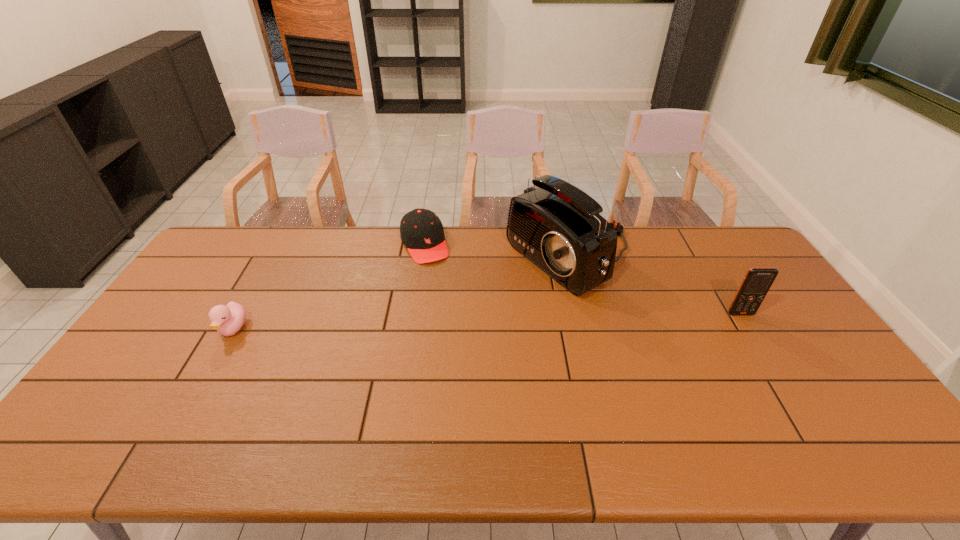
Image resolution: width=960 pixels, height=540 pixels. Identify the location of the leftmost object. pos(228,320).

Image resolution: width=960 pixels, height=540 pixels. What are the coordinates of `the rightmost object` in the screenshot? It's located at (757, 281).

Find the location of `cellular telephone`. cellular telephone is located at coordinates click(757, 281).

The height and width of the screenshot is (540, 960). Find the location of `cap`. cap is located at coordinates (421, 231).

The width and height of the screenshot is (960, 540). Identify the location of radio receiver. (557, 226).

This screenshot has width=960, height=540. I want to click on the third object from left to right, so click(x=557, y=226).

Find the location of a particular element. The height and width of the screenshot is (540, 960). vacant region located on the front-facing side of the leftmost object is located at coordinates (197, 393).

Where is `vacant space located 0.060m on the screen of the cellular telephone`? The height and width of the screenshot is (540, 960). vacant space located 0.060m on the screen of the cellular telephone is located at coordinates (752, 331).

The width and height of the screenshot is (960, 540). I want to click on blank area located on the front-facing side of the third object from right to left, so (444, 289).

Find the location of `vacant space located 0.380m on the front-facing side of the third object from right to left`. vacant space located 0.380m on the front-facing side of the third object from right to left is located at coordinates (469, 342).